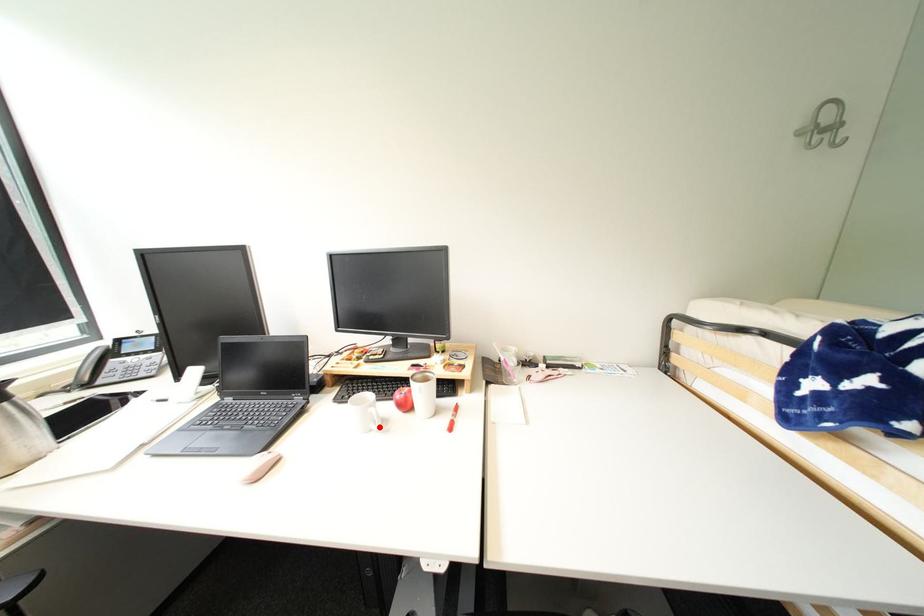
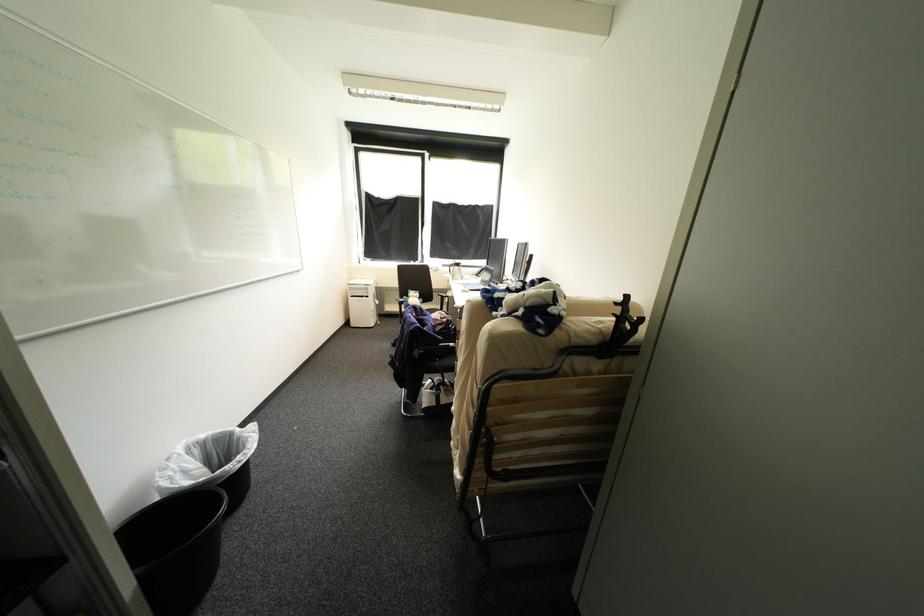
Question: I am providing you with two images of the same scene from different viewpoints. A red point is marked on the first image. Can you still see the location of the red point in image 2?

Choices:
 (A) Yes
 (B) No

Answer: (B)